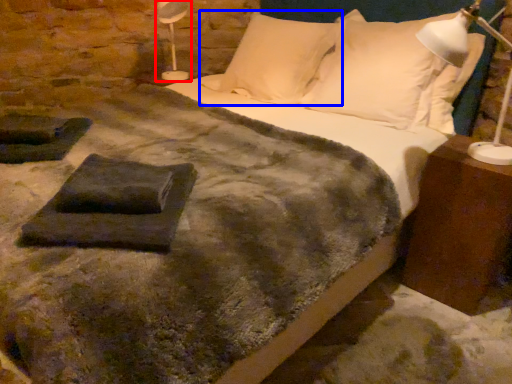
Question: Which object appears closest to the camera in this image, table lamp (highlighted by a red box) or pillow (highlighted by a blue box)?

Choices:
 (A) table lamp
 (B) pillow

Answer: (B)